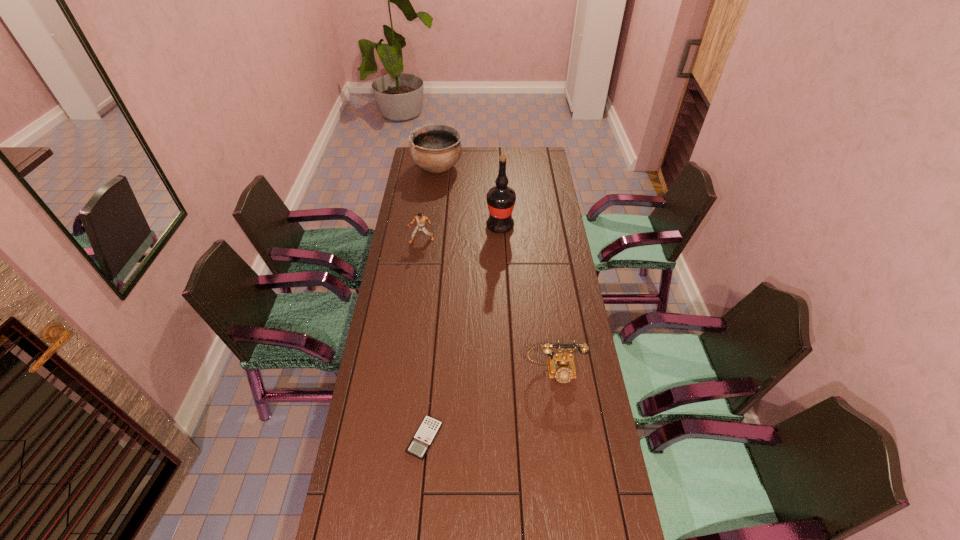
Where is `vacant space at the right edge of the desktop`? vacant space at the right edge of the desktop is located at coordinates (561, 214).

Locate an element on the screen. vacant point located between the farthest object and the telephone is located at coordinates (496, 269).

What are the coordinates of `free space that is in between the calculator and the tallest object` in the screenshot? It's located at (463, 333).

Locate an element on the screen. Image resolution: width=960 pixels, height=540 pixels. free space that is in between the calculator and the tallest object is located at coordinates (463, 333).

Image resolution: width=960 pixels, height=540 pixels. I want to click on vacant area between the puncher and the fourth shortest object, so click(x=430, y=204).

The width and height of the screenshot is (960, 540). Find the location of `vacant area between the telephone and the shortest object`. vacant area between the telephone and the shortest object is located at coordinates (490, 405).

Locate an element on the screen. The image size is (960, 540). empty space that is in between the fourth shortest object and the fourth farthest object is located at coordinates (496, 269).

Find the location of a particular element. The image size is (960, 540). vacant region between the nearest object and the tallest object is located at coordinates (463, 333).

The image size is (960, 540). I want to click on free space between the puncher and the telephone, so click(488, 306).

At what (x,y) coordinates should I click in order to perform the action: click on free space between the farthest object and the tallest object. Please return your answer as a coordinate pair (x, y). This screenshot has width=960, height=540. Looking at the image, I should click on (468, 197).